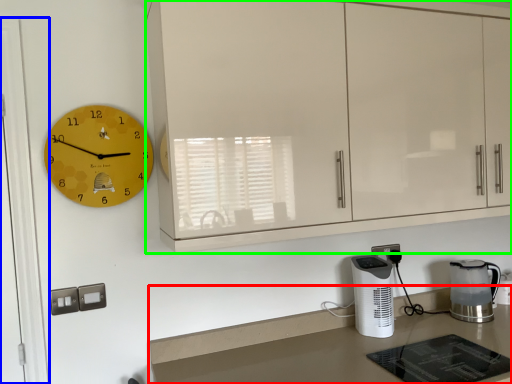
Question: Based on their relative distances, which object is nearer to countertop (highlighted by a red box)? Choose from glass door (highlighted by a blue box) and cabinetry (highlighted by a green box).

Choices:
 (A) glass door
 (B) cabinetry

Answer: (B)